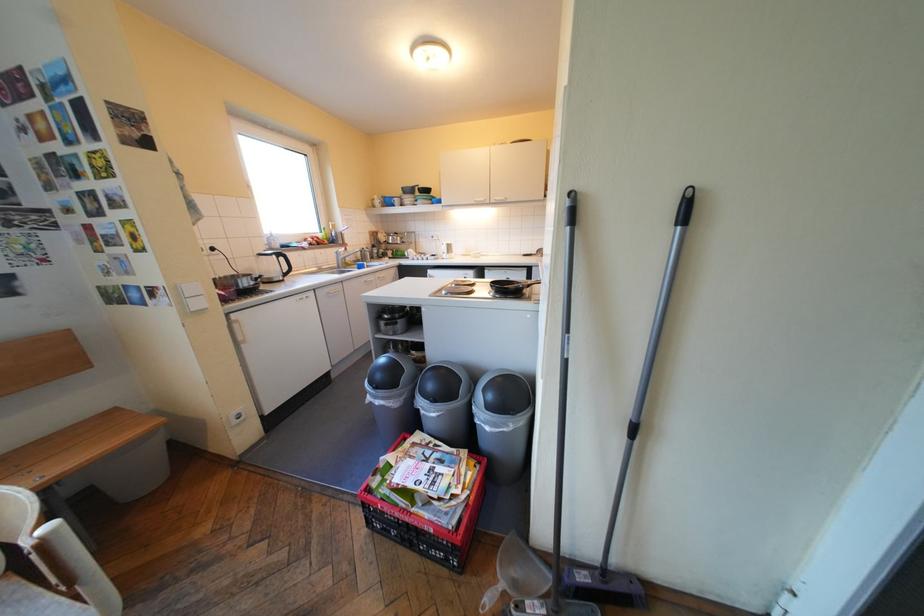
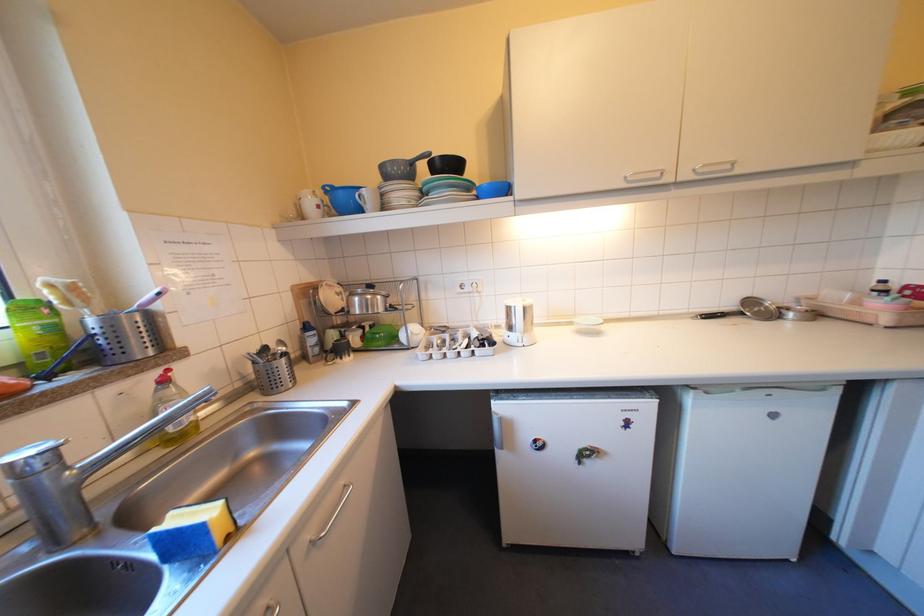
Find the pixel in the second image that matches point (416, 188) in the first image.

(395, 167)